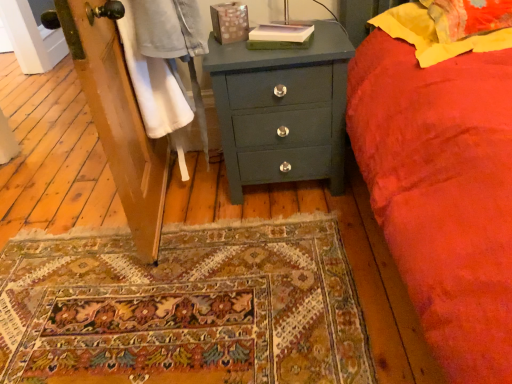
Question: Does yellow fabric pillow at upper right, which appears as the 1th pillow when ordered from the bottom, turn towards yellow fabric pillow at upper right, which is the first pillow from top to bottom?

Choices:
 (A) no
 (B) yes

Answer: (A)

Question: Is yellow fabric pillow at upper right, the 2th pillow viewed from the top, smaller than yellow fabric pillow at upper right, arranged as the second pillow when ordered from the bottom?

Choices:
 (A) no
 (B) yes

Answer: (B)

Question: Is yellow fabric pillow at upper right, the 2th pillow viewed from the top, directly adjacent to yellow fabric pillow at upper right, arranged as the second pillow when ordered from the bottom?

Choices:
 (A) no
 (B) yes

Answer: (B)

Question: From a real-world perspective, is yellow fabric pillow at upper right, which appears as the 1th pillow when ordered from the bottom, positioned under yellow fabric pillow at upper right, which is the first pillow from top to bottom, based on gravity?

Choices:
 (A) yes
 (B) no

Answer: (A)

Question: From the image's perspective, does yellow fabric pillow at upper right, which appears as the 1th pillow when ordered from the bottom, appear higher than yellow fabric pillow at upper right, arranged as the second pillow when ordered from the bottom?

Choices:
 (A) yes
 (B) no

Answer: (B)

Question: Is yellow fabric pillow at upper right, the 2th pillow viewed from the top, behind yellow fabric pillow at upper right, which is the first pillow from top to bottom?

Choices:
 (A) no
 (B) yes

Answer: (A)

Question: Does matte green chest of drawers at center have a larger size compared to yellow fabric pillow at upper right, which appears as the 1th pillow when ordered from the bottom?

Choices:
 (A) yes
 (B) no

Answer: (A)

Question: Is matte green chest of drawers at center positioned beyond the bounds of yellow fabric pillow at upper right, which appears as the 1th pillow when ordered from the bottom?

Choices:
 (A) yes
 (B) no

Answer: (A)

Question: From a real-world perspective, is matte green chest of drawers at center located higher than yellow fabric pillow at upper right, the 2th pillow viewed from the top?

Choices:
 (A) no
 (B) yes

Answer: (A)

Question: From a real-world perspective, is matte green chest of drawers at center positioned under yellow fabric pillow at upper right, the 2th pillow viewed from the top, based on gravity?

Choices:
 (A) no
 (B) yes

Answer: (B)

Question: Is matte green chest of drawers at center far away from yellow fabric pillow at upper right, the 2th pillow viewed from the top?

Choices:
 (A) yes
 (B) no

Answer: (B)

Question: Can you confirm if matte green chest of drawers at center is taller than yellow fabric pillow at upper right, which appears as the 1th pillow when ordered from the bottom?

Choices:
 (A) yes
 (B) no

Answer: (A)

Question: Is yellow fabric pillow at upper right, which is the first pillow from top to bottom, completely or partially outside of matte green chest of drawers at center?

Choices:
 (A) yes
 (B) no

Answer: (A)